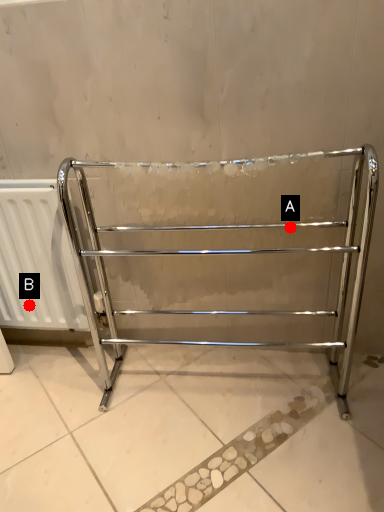
Question: Two points are circled on the image, labeled by A and B beside each circle. Which of the following is the farthest from the observer?

Choices:
 (A) A is further
 (B) B is further

Answer: (B)